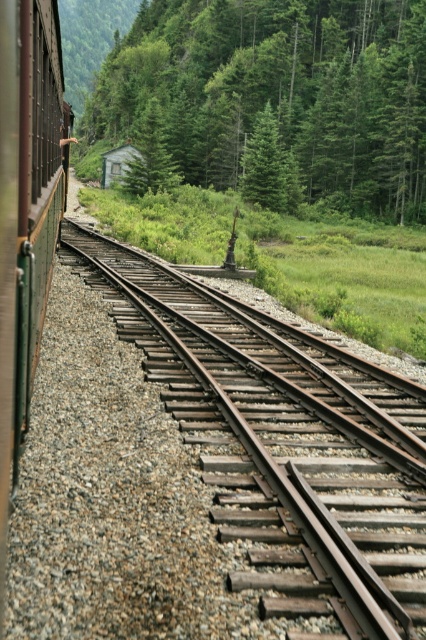
Question: Is the position of green matte train car at left less distant than that of green glass window at left?

Choices:
 (A) yes
 (B) no

Answer: (A)

Question: Which point is closer to the camera taking this photo?

Choices:
 (A) (385, 86)
 (B) (258, 342)
 (C) (37, 81)
 (D) (17, 244)

Answer: (D)

Question: Does green leafy tree at center appear under green glass window at left?

Choices:
 (A) no
 (B) yes

Answer: (A)

Question: Is green leafy tree at center closer to the viewer compared to green matte train car at left?

Choices:
 (A) no
 (B) yes

Answer: (A)

Question: Among these objects, which one is nearest to the camera?

Choices:
 (A) rusty metal train track at center
 (B) green matte train car at left
 (C) green glass window at left

Answer: (B)

Question: Estimate the real-world distances between objects in this image. Which object is farther from the green leafy tree at center?

Choices:
 (A) green glass window at left
 (B) green matte train car at left
 (C) rusty metal train track at center

Answer: (C)